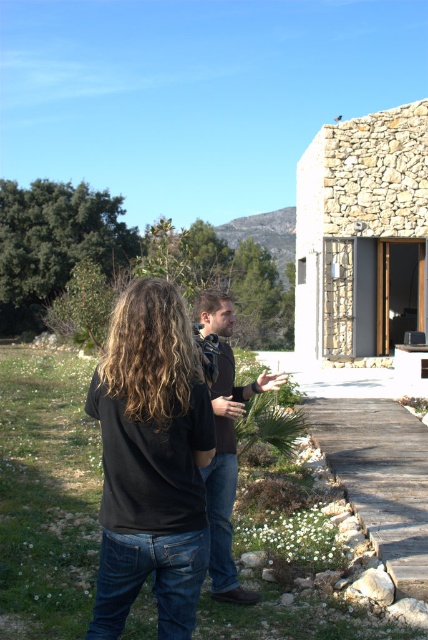
Question: Can you confirm if black matte shirt at center is positioned above wooden at center?

Choices:
 (A) yes
 (B) no

Answer: (A)

Question: In this image, where is black matte shirt at center located relative to wooden at center?

Choices:
 (A) below
 (B) above

Answer: (B)

Question: Which point is closer to the camera taking this photo?

Choices:
 (A) (214, 557)
 (B) (155, 444)
 (C) (308, 397)

Answer: (B)

Question: Considering the real-world distances, which object is farthest from the wooden at center?

Choices:
 (A) black matte shirt at center
 (B) brown leather jacket at center

Answer: (A)

Question: Which point is closer to the camera taking this photo?

Choices:
 (A) (151, 556)
 (B) (226, 353)

Answer: (A)

Question: Considering the relative positions of black matte shirt at center and wooden at center in the image provided, where is black matte shirt at center located with respect to wooden at center?

Choices:
 (A) below
 (B) above

Answer: (B)